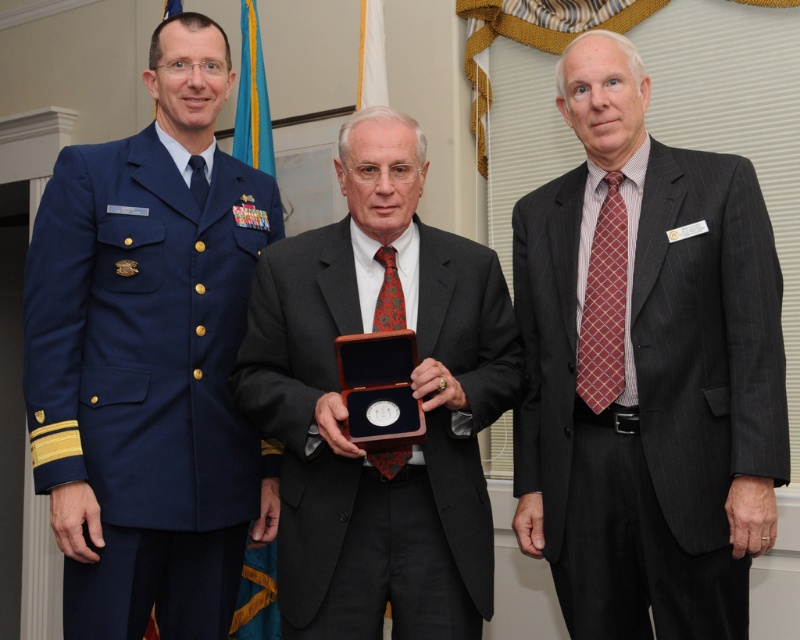
Question: Does dark gray pinstripe suit at right have a smaller size compared to blue fabric uniform at left?

Choices:
 (A) yes
 (B) no

Answer: (A)

Question: Which point is farther to the camera?

Choices:
 (A) (66, 202)
 (B) (310, 620)
 (C) (550, 472)

Answer: (C)

Question: Can you confirm if dark gray pinstripe suit at right is thinner than blue fabric uniform at left?

Choices:
 (A) yes
 (B) no

Answer: (B)

Question: Which point is farther to the camera?

Choices:
 (A) dark gray pinstripe suit at right
 (B) matte black suit at center
 (C) blue fabric uniform at left

Answer: (C)

Question: Is blue fabric uniform at left to the left of matte black suit at center from the viewer's perspective?

Choices:
 (A) yes
 (B) no

Answer: (A)

Question: Which object appears closest to the camera in this image?

Choices:
 (A) blue fabric uniform at left
 (B) dark gray pinstripe suit at right
 (C) matte black suit at center

Answer: (B)